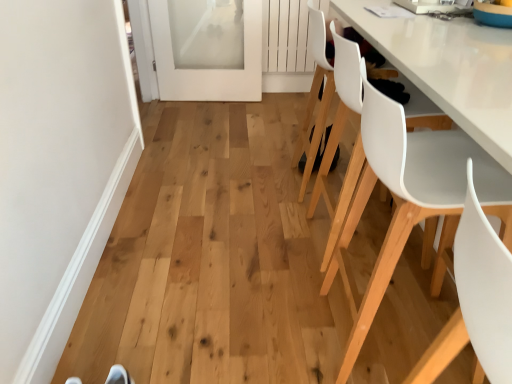
The height and width of the screenshot is (384, 512). Describe the element at coordinates (58, 168) in the screenshot. I see `white smooth door at left` at that location.

In order to face white plastic chair at right, which ranks as the 2th chair in front-to-back order, should I rotate leftwards or rightwards?

You should look right and rotate roughly 20.809 degrees.

Image resolution: width=512 pixels, height=384 pixels. Find the location of `white plastic chair at center, acting as the 3th chair starting from the front`. white plastic chair at center, acting as the 3th chair starting from the front is located at coordinates (344, 177).

Locate an element on the screen. white smooth door at left is located at coordinates (58, 168).

Are white plastic chair at center, acting as the 3th chair starting from the front, and white smooth door at left making contact?

No, white plastic chair at center, acting as the 3th chair starting from the front, is not with white smooth door at left.

Can you confirm if white plastic chair at center, acting as the 3th chair starting from the front, is smaller than white smooth door at left?

No, white plastic chair at center, acting as the 3th chair starting from the front, is not smaller than white smooth door at left.

Which is behind, point (328, 242) or point (26, 217)?

The point (328, 242) is more distant.

Can you confirm if white smooth door at left is smaller than white matte chair at lower right, marked as the fourth chair in a back-to-front arrangement?

Correct, white smooth door at left occupies less space than white matte chair at lower right, marked as the fourth chair in a back-to-front arrangement.

Visually, is white smooth door at left positioned to the left or to the right of white matte chair at lower right, marked as the fourth chair in a back-to-front arrangement?

Clearly, white smooth door at left is on the left of white matte chair at lower right, marked as the fourth chair in a back-to-front arrangement, in the image.

Is white smooth door at left in contact with white matte chair at lower right, marked as the fourth chair in a back-to-front arrangement?

No.

How many degrees apart are the facing directions of white smooth door at left and white matte chair at lower right, which is counted as the 1th chair, starting from the front?

6.14 degrees.

Consider the image. Considering their positions, is white smooth door at left located in front of or behind white matte chair at right, the 4th chair from the front?

In the image, white smooth door at left appears in front of white matte chair at right, the 4th chair from the front.

Is white smooth door at left next to white matte chair at right, the 4th chair from the front, and touching it?

white smooth door at left and white matte chair at right, the 4th chair from the front, are not in contact.

Can we say white smooth door at left lies outside white matte chair at right, the 1th chair positioned from the back?

Indeed, white smooth door at left is completely outside white matte chair at right, the 1th chair positioned from the back.

What are the coordinates of `door located underneath the white matte chair at right, the 4th chair from the front (from a real-world perspective)` in the screenshot? It's located at (58, 168).

Is white plastic chair at right, which ranks as the 2th chair in front-to-back order, taller than white smooth door at left?

Yes.

From the image's perspective, would you say white plastic chair at right, which is the 3th chair in back-to-front order, is shown under white smooth door at left?

No, from the image's perspective, white plastic chair at right, which is the 3th chair in back-to-front order, is not below white smooth door at left.

From a real-world perspective, is white plastic chair at right, which ranks as the 2th chair in front-to-back order, over white smooth door at left?

Yes, from a real-world perspective, white plastic chair at right, which ranks as the 2th chair in front-to-back order, is above white smooth door at left.

Is white plastic chair at right, which is the 3th chair in back-to-front order, in contact with white smooth door at left?

white plastic chair at right, which is the 3th chair in back-to-front order, is not next to white smooth door at left, and they're not touching.

Who is bigger, white frosted glass door at upper left or white matte chair at lower right, which is counted as the 1th chair, starting from the front?

With larger size is white frosted glass door at upper left.

From a real-world perspective, is white frosted glass door at upper left positioned under white matte chair at lower right, marked as the fourth chair in a back-to-front arrangement, based on gravity?

Yes, from a real-world perspective, white frosted glass door at upper left is under white matte chair at lower right, marked as the fourth chair in a back-to-front arrangement.

Based on the photo, is white frosted glass door at upper left turned away from white matte chair at lower right, which is counted as the 1th chair, starting from the front?

That's not correct — white frosted glass door at upper left is not looking away from white matte chair at lower right, which is counted as the 1th chair, starting from the front.

In terms of width, does white frosted glass door at upper left look wider or thinner when compared to white matte chair at lower right, marked as the fourth chair in a back-to-front arrangement?

white frosted glass door at upper left is thinner than white matte chair at lower right, marked as the fourth chair in a back-to-front arrangement.

Does white matte chair at lower right, which is counted as the 1th chair, starting from the front, come behind white smooth door at left?

No, the depth of white matte chair at lower right, which is counted as the 1th chair, starting from the front, is less than that of white smooth door at left.

From a real-world perspective, between white matte chair at lower right, which is counted as the 1th chair, starting from the front, and white smooth door at left, who is vertically lower?

white smooth door at left, from a real-world perspective.

Does point (480, 248) appear closer or farther from the camera than point (8, 344)?

Point (480, 248) is closer to the camera than point (8, 344).

How different are the orientations of white matte chair at lower right, which is counted as the 1th chair, starting from the front, and white smooth door at left in degrees?

6.14 degrees separate the facing orientations of white matte chair at lower right, which is counted as the 1th chair, starting from the front, and white smooth door at left.

How many degrees apart are the facing directions of white plastic chair at right, which ranks as the 2th chair in front-to-back order, and white plastic chair at center, acting as the 3th chair starting from the front?

1.85 degrees separate the facing orientations of white plastic chair at right, which ranks as the 2th chair in front-to-back order, and white plastic chair at center, acting as the 3th chair starting from the front.

Considering the sizes of objects white plastic chair at right, which is the 3th chair in back-to-front order, and white plastic chair at center, acting as the 3th chair starting from the front, in the image provided, who is bigger, white plastic chair at right, which is the 3th chair in back-to-front order, or white plastic chair at center, acting as the 3th chair starting from the front,?

white plastic chair at right, which is the 3th chair in back-to-front order.

How distant is white plastic chair at right, which is the 3th chair in back-to-front order, from white plastic chair at center, positioned as the 2th chair in back-to-front order?

white plastic chair at right, which is the 3th chair in back-to-front order, and white plastic chair at center, positioned as the 2th chair in back-to-front order, are 9.60 inches apart from each other.

Is white plastic chair at right, which is the 3th chair in back-to-front order, behind white plastic chair at center, positioned as the 2th chair in back-to-front order?

No, the depth of white plastic chair at right, which is the 3th chair in back-to-front order, is less than that of white plastic chair at center, positioned as the 2th chair in back-to-front order.

Image resolution: width=512 pixels, height=384 pixels. I want to click on the 1st chair behind the white smooth door at left, so click(344, 177).

Locate an element on the screen. the 2nd chair in front of the white smooth door at left is located at coordinates [x=475, y=301].

Based on their spatial positions, is white plastic chair at right, which is the 3th chair in back-to-front order, or white frosted glass door at upper left closer to white plastic chair at center, acting as the 3th chair starting from the front?

white plastic chair at right, which is the 3th chair in back-to-front order, is positioned closer to the anchor white plastic chair at center, acting as the 3th chair starting from the front.

Estimate the real-world distances between objects in this image. Which object is closer to white plastic chair at right, which ranks as the 2th chair in front-to-back order, white plastic chair at center, acting as the 3th chair starting from the front, or white smooth door at left?

The object closer to white plastic chair at right, which ranks as the 2th chair in front-to-back order, is white plastic chair at center, acting as the 3th chair starting from the front.

Estimate the real-world distances between objects in this image. Which object is closer to white plastic chair at center, acting as the 3th chair starting from the front, white frosted glass door at upper left or white matte chair at lower right, which is counted as the 1th chair, starting from the front?

Based on the image, white matte chair at lower right, which is counted as the 1th chair, starting from the front, appears to be nearer to white plastic chair at center, acting as the 3th chair starting from the front.

Considering their positions, is white plastic chair at center, acting as the 3th chair starting from the front, positioned further to white matte chair at lower right, marked as the fourth chair in a back-to-front arrangement, than white plastic chair at right, which ranks as the 2th chair in front-to-back order?

Based on the image, white plastic chair at center, acting as the 3th chair starting from the front, appears to be further to white matte chair at lower right, marked as the fourth chair in a back-to-front arrangement.

From the image, which object appears to be farther from white smooth door at left, white matte chair at right, the 4th chair from the front, or white plastic chair at center, acting as the 3th chair starting from the front?

white plastic chair at center, acting as the 3th chair starting from the front, is positioned further to the anchor white smooth door at left.

When comparing their distances from white smooth door at left, does white matte chair at right, the 1th chair positioned from the back, or white plastic chair at right, which is the 3th chair in back-to-front order, seem further?

The object further to white smooth door at left is white plastic chair at right, which is the 3th chair in back-to-front order.

When comparing their distances from white smooth door at left, does white frosted glass door at upper left or white plastic chair at center, acting as the 3th chair starting from the front, seem closer?

Based on the image, white plastic chair at center, acting as the 3th chair starting from the front, appears to be nearer to white smooth door at left.

Estimate the real-world distances between objects in this image. Which object is further from white smooth door at left, white plastic chair at right, which ranks as the 2th chair in front-to-back order, or white plastic chair at center, positioned as the 2th chair in back-to-front order?

The object further to white smooth door at left is white plastic chair at right, which ranks as the 2th chair in front-to-back order.

Find the location of a particular element. chair located between white plastic chair at right, which ranks as the 2th chair in front-to-back order, and white matte chair at right, the 4th chair from the front, in the depth direction is located at coordinates (344, 177).

I want to click on door between white plastic chair at right, which is the 3th chair in back-to-front order, and white frosted glass door at upper left, along the z-axis, so click(58, 168).

The image size is (512, 384). Identify the location of chair between white matte chair at lower right, marked as the fourth chair in a back-to-front arrangement, and white plastic chair at center, positioned as the 2th chair in back-to-front order, from front to back. (412, 201).

Find the location of a particular element. door between white matte chair at lower right, marked as the fourth chair in a back-to-front arrangement, and white frosted glass door at upper left, along the z-axis is located at coordinates (58, 168).